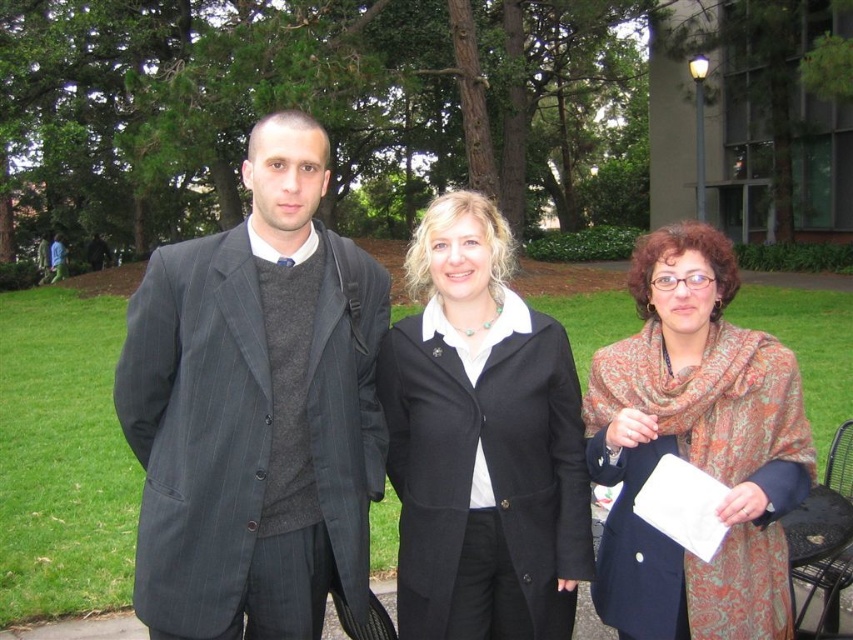
Question: Can you confirm if dark gray pinstripe suit at center is smaller than patterned scarf at center?

Choices:
 (A) no
 (B) yes

Answer: (A)

Question: Is matte black suit at center in front of dark gray pinstripe suit at center?

Choices:
 (A) yes
 (B) no

Answer: (B)

Question: Can you confirm if black wool coat at center is wider than patterned scarf at center?

Choices:
 (A) no
 (B) yes

Answer: (A)

Question: Which of the following is the closest to the observer?

Choices:
 (A) (434, 467)
 (B) (187, 483)
 (C) (798, 392)
 (D) (422, 285)

Answer: (B)

Question: Which point is closer to the camera?

Choices:
 (A) (341, 385)
 (B) (624, 632)
 (C) (549, 499)

Answer: (A)

Question: Which is nearer to the black wool coat at center?

Choices:
 (A) matte black suit at center
 (B) patterned scarf at center
 (C) dark gray pinstripe suit at center

Answer: (A)